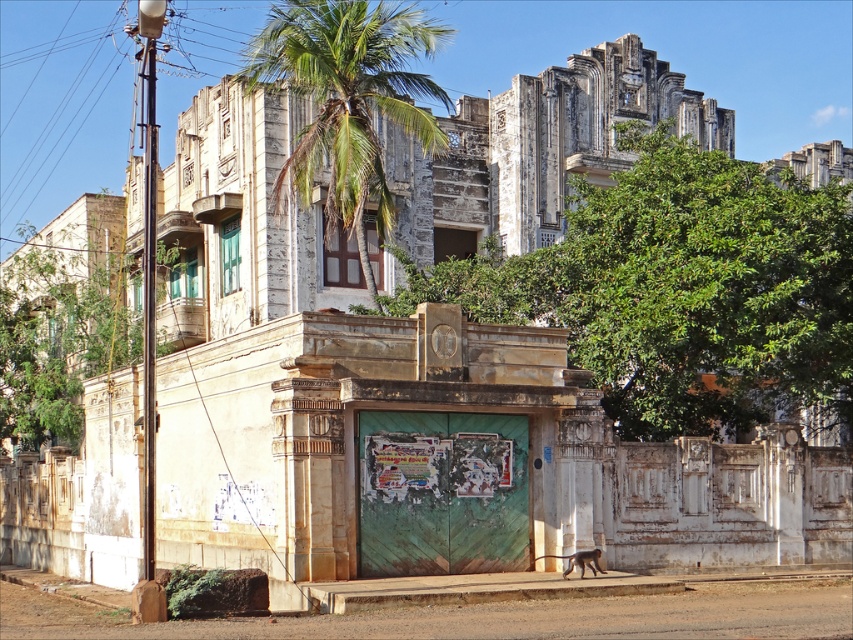
Question: Which object is closer to the camera taking this photo?

Choices:
 (A) green leafy tree at left
 (B) green leafy tree at center
 (C) green leafy palm tree at upper center

Answer: (B)

Question: Which is farther from the green leafy tree at center?

Choices:
 (A) green leafy tree at left
 (B) green leafy palm tree at upper center

Answer: (A)

Question: Does green leafy palm tree at upper center have a larger size compared to green leafy tree at left?

Choices:
 (A) yes
 (B) no

Answer: (A)

Question: Does green leafy palm tree at upper center lie behind green leafy tree at left?

Choices:
 (A) no
 (B) yes

Answer: (A)

Question: Among these objects, which one is farthest from the camera?

Choices:
 (A) green leafy tree at left
 (B) green leafy palm tree at upper center
 (C) green leafy tree at center

Answer: (A)

Question: In this image, where is green leafy palm tree at upper center located relative to green leafy tree at left?

Choices:
 (A) left
 (B) right

Answer: (B)